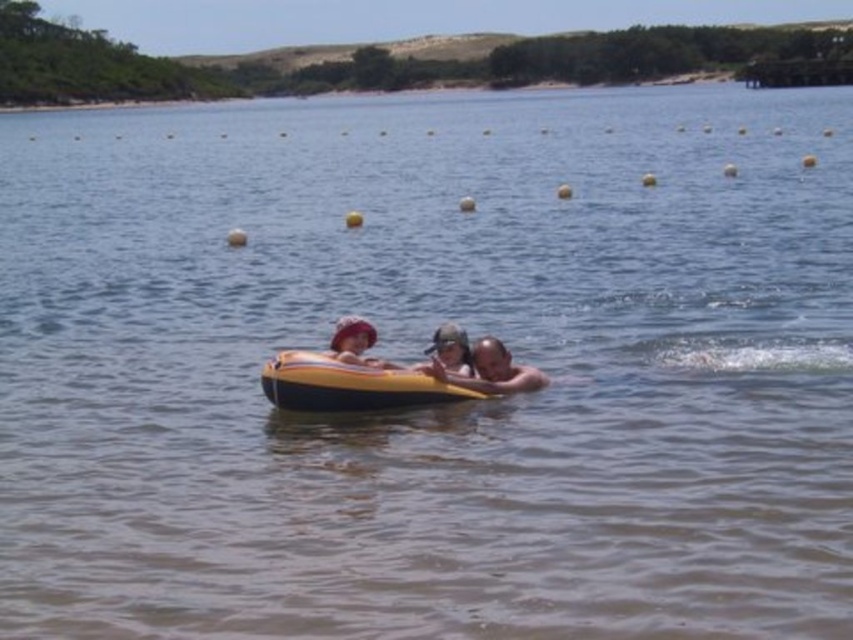
Is smooth skin man at center closer to the viewer compared to matte yellow float at center?

Yes.

Who is more forward, (488,368) or (338,321)?

Point (488,368)

Find the location of a particular element. Image resolution: width=853 pixels, height=640 pixels. smooth skin man at center is located at coordinates (490, 371).

I want to click on smooth skin man at center, so click(490, 371).

Between yellow rubber boat at center and matte yellow float at center, which one has less height?

matte yellow float at center

Does yellow rubber boat at center appear under matte yellow float at center?

Yes.

Does point (297, 362) lie behind point (354, 317)?

No, (297, 362) is closer to viewer.

At what (x,y) coordinates should I click in order to perform the action: click on yellow rubber boat at center. Please return your answer as a coordinate pair (x, y). This screenshot has width=853, height=640. Looking at the image, I should click on (349, 385).

Is yellow rubber boat at center taller than smooth skin man at center?

Yes, yellow rubber boat at center is taller than smooth skin man at center.

Is yellow rubber boat at center wider than smooth skin man at center?

Correct, the width of yellow rubber boat at center exceeds that of smooth skin man at center.

Which is behind, point (331, 401) or point (437, 376)?

The point (437, 376) is more distant.

The image size is (853, 640). What are the coordinates of `yellow rubber boat at center` in the screenshot? It's located at (349, 385).